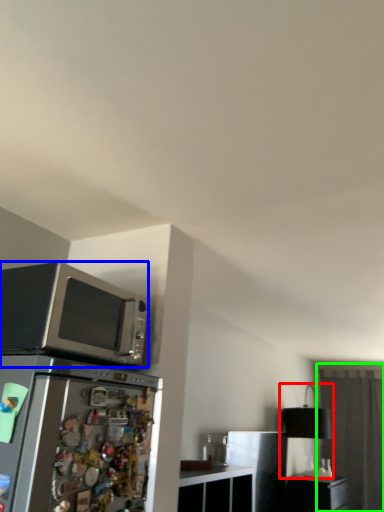
Question: Estimate the real-world distances between objects in this image. Which object is closer to lamp (highlighted by a red box), microwave oven (highlighted by a blue box) or glass door (highlighted by a green box)?

Choices:
 (A) microwave oven
 (B) glass door

Answer: (B)